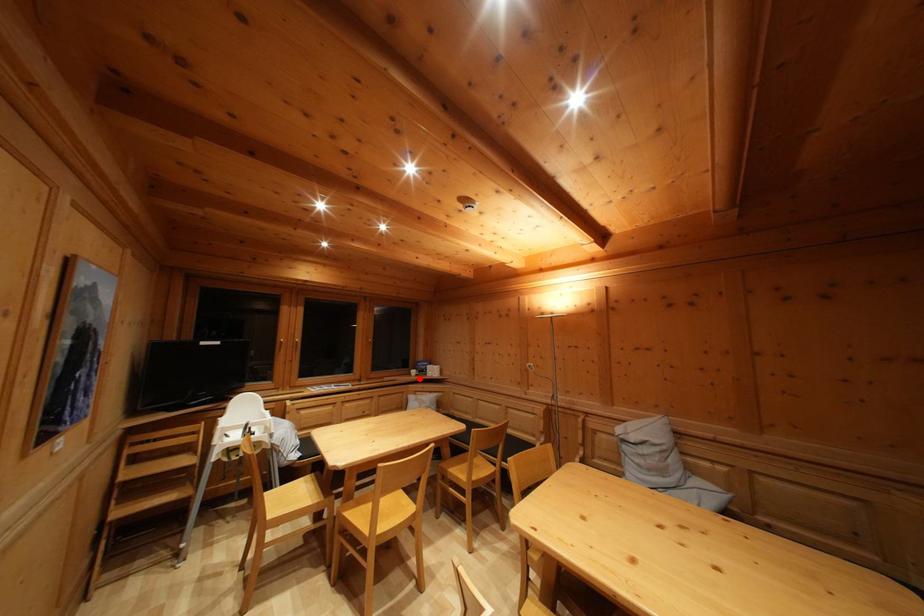
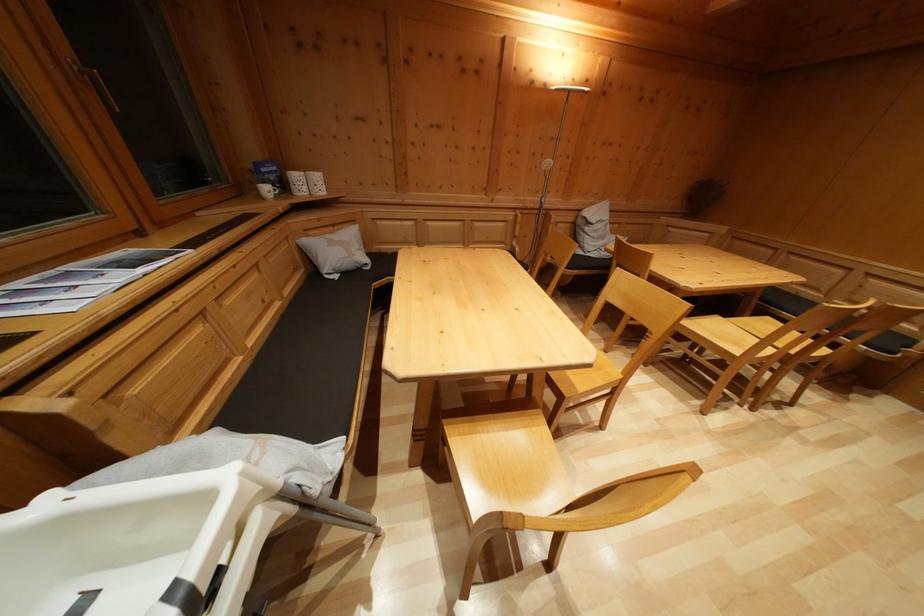
Question: I am providing you with two images of the same scene from different viewpoints. A red point is shown in image1. For the corresponding object point in image2, is it positioned nearer or farther from the camera?

Choices:
 (A) Nearer
 (B) Farther

Answer: (A)